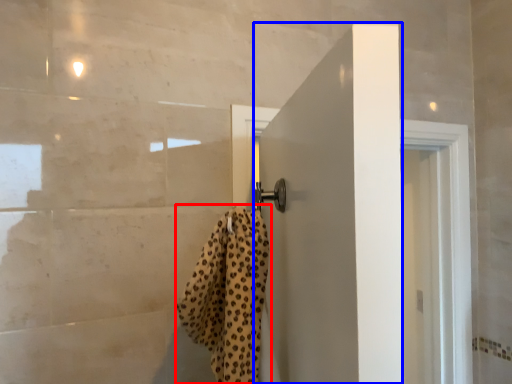
Question: Which point is further to the camera, bath towel (highlighted by a red box) or door (highlighted by a blue box)?

Choices:
 (A) bath towel
 (B) door

Answer: (B)